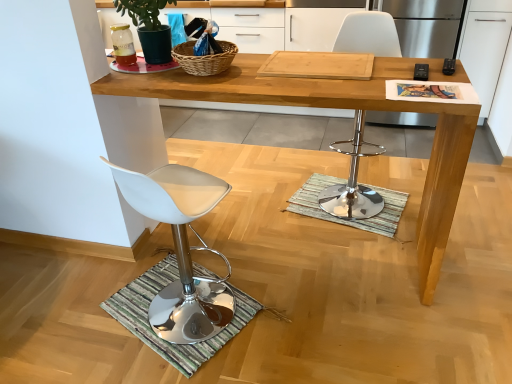
Question: Can you confirm if chrome metallic bar stool at center, which is the 1th chair from right to left, is smaller than striped fabric doormat at center, the 1th doormat in the back-to-front sequence?

Choices:
 (A) yes
 (B) no

Answer: (B)

Question: Is the surface of chrome metallic bar stool at center, the 2th chair positioned from the left, in direct contact with striped fabric doormat at center, the second doormat in the bottom-to-top sequence?

Choices:
 (A) no
 (B) yes

Answer: (A)

Question: Is chrome metallic bar stool at center, the 2th chair positioned from the left, bigger than striped fabric doormat at center, placed as the first doormat when sorted from right to left?

Choices:
 (A) no
 (B) yes

Answer: (B)

Question: Can you confirm if chrome metallic bar stool at center, which is the 1th chair from right to left, is wider than striped fabric doormat at center, the 1th doormat positioned from the top?

Choices:
 (A) yes
 (B) no

Answer: (B)

Question: Does chrome metallic bar stool at center, which is the 1th chair from right to left, have a lesser height compared to striped fabric doormat at center, the second doormat in the bottom-to-top sequence?

Choices:
 (A) no
 (B) yes

Answer: (A)

Question: From a real-world perspective, is green matte plant at upper left positioned above or below black plastic remote control at upper right, the 1th remote control when ordered from right to left?

Choices:
 (A) above
 (B) below

Answer: (A)

Question: Is green matte plant at upper left taller or shorter than black plastic remote control at upper right, marked as the second remote control in a left-to-right arrangement?

Choices:
 (A) short
 (B) tall

Answer: (B)

Question: Is green matte plant at upper left inside or outside of black plastic remote control at upper right, marked as the second remote control in a left-to-right arrangement?

Choices:
 (A) inside
 (B) outside

Answer: (B)

Question: Would you say green matte plant at upper left is to the left or to the right of black plastic remote control at upper right, the 1th remote control when ordered from right to left, in the picture?

Choices:
 (A) left
 (B) right

Answer: (A)

Question: Relative to green matte plant at upper left, is wooden desk at center in front or behind?

Choices:
 (A) front
 (B) behind

Answer: (A)

Question: From the image's perspective, is wooden desk at center located above or below green matte plant at upper left?

Choices:
 (A) above
 (B) below

Answer: (B)

Question: Considering the positions of point 305,89 and point 119,3, is point 305,89 closer or farther from the camera than point 119,3?

Choices:
 (A) closer
 (B) farther

Answer: (A)

Question: From a real-world perspective, relative to green matte plant at upper left, is wooden desk at center vertically above or below?

Choices:
 (A) above
 (B) below

Answer: (B)

Question: In the image, is green striped mat at lower left, the first doormat positioned from the bottom, on the left side or the right side of black plastic remote control at upper right, marked as the first remote control in a left-to-right arrangement?

Choices:
 (A) left
 (B) right

Answer: (A)

Question: In terms of height, does green striped mat at lower left, the 1th doormat when ordered from left to right, look taller or shorter compared to black plastic remote control at upper right, which is the second remote control from right to left?

Choices:
 (A) short
 (B) tall

Answer: (B)